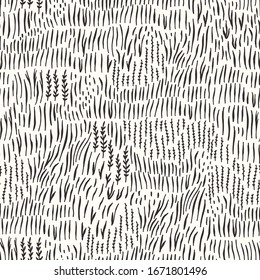
Locate an element on the screen. Image resolution: width=260 pixels, height=280 pixels. minimalist floral wallpaper is located at coordinates (9, 10), (255, 253), (251, 4), (7, 251).